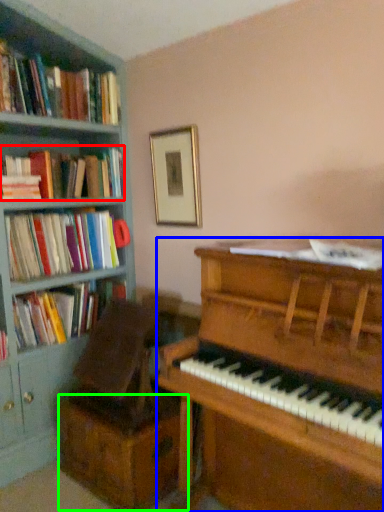
Question: Which object is the closest to the book (highlighted by a red box)? Choose among these: piano (highlighted by a blue box) or drawer (highlighted by a green box).

Choices:
 (A) piano
 (B) drawer

Answer: (B)